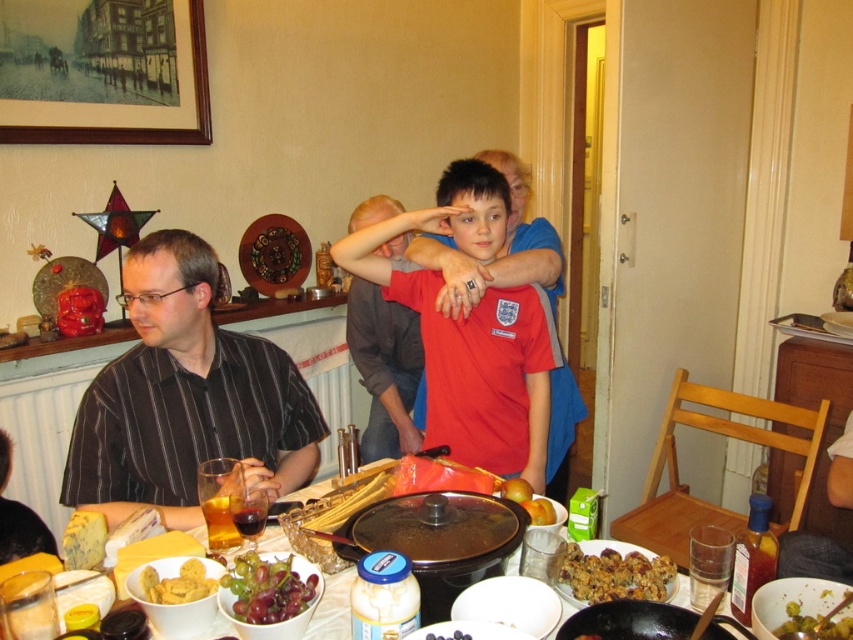
You are a guest at this gathering and want to reach for the yellow matte cookies at lower left. However, there is a black striped shirt at left in your way. Can you easily access the cookies without moving the shirt?

The yellow matte cookies at lower left is behind the black striped shirt at left, so you would need to move or adjust the shirt to access them easily.

You are a guest at the gathering and want to grab a cookie from the yellow matte cookies at lower left without moving too far from your current position. You are currently standing next to the black striped shirt at left. Is the cookie within arm reach?

The black striped shirt at left is to the left of yellow matte cookies at lower left, meaning the cookies are to the right of the shirt. Since you are standing next to the black striped shirt at left, the yellow matte cookies at lower left are to your right, so they are within arm reach.